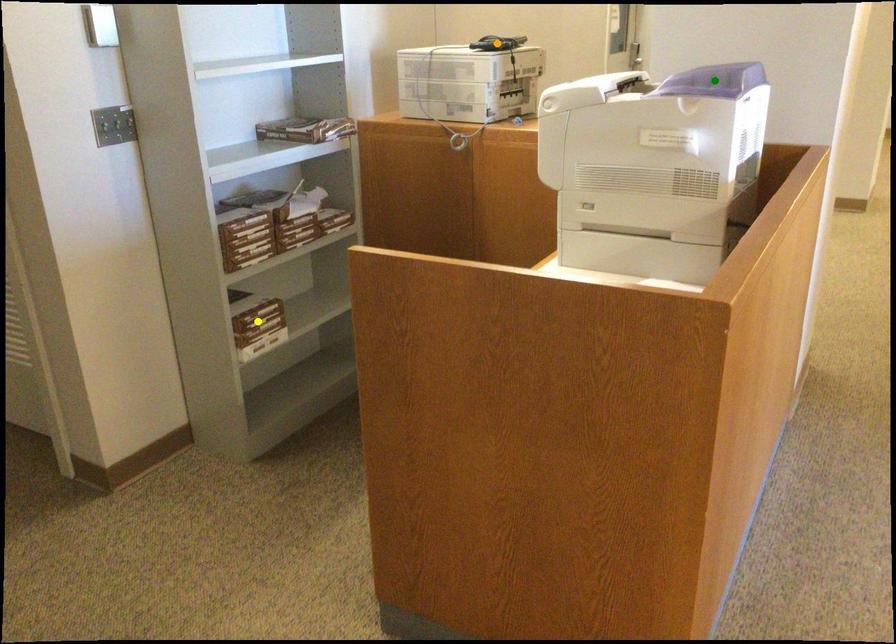
Order these from nearest to farthest:
A) green point
B) yellow point
C) orange point

1. green point
2. yellow point
3. orange point